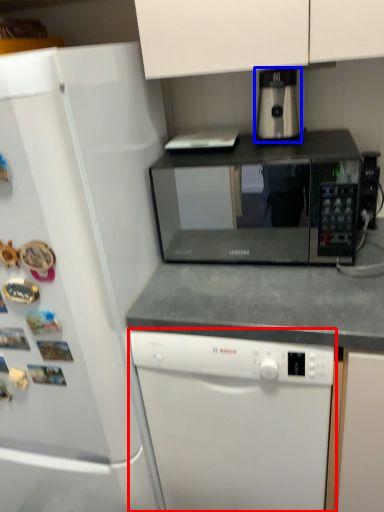
Question: Which of the following is the farthest to the observer, dishwasher (highlighted by a red box) or coffee machine (highlighted by a blue box)?

Choices:
 (A) dishwasher
 (B) coffee machine

Answer: (B)